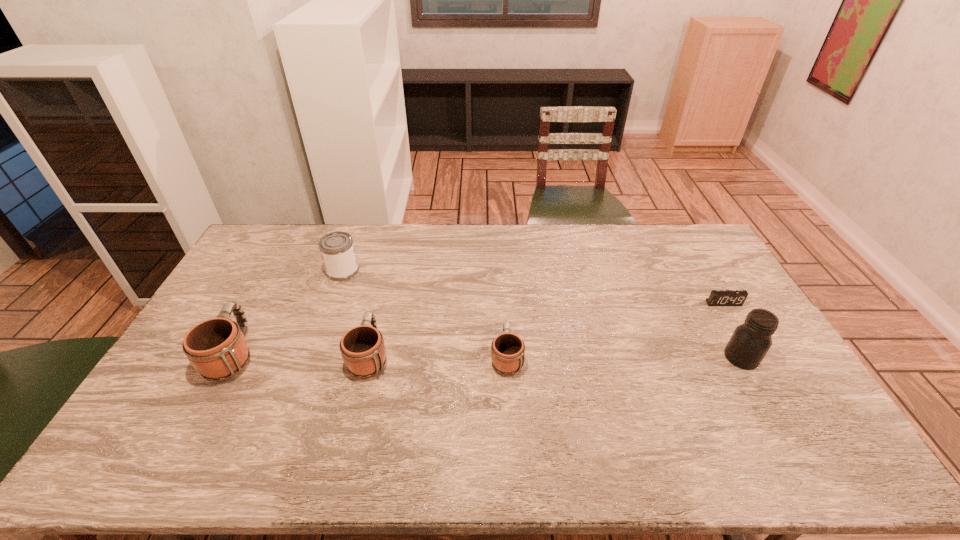
Where is `vacant region located 0.230m on the back of the farthest object`? vacant region located 0.230m on the back of the farthest object is located at coordinates (359, 226).

Locate an element on the screen. This screenshot has width=960, height=540. vacant area situated 0.120m on the front-facing side of the alarm clock is located at coordinates (741, 334).

You are a GUI agent. You are given a task and a screenshot of the screen. Output one action in this format:
    pyautogui.click(x=<x>, y=<y>)
    Task: Click on the blank space located on the left of the jar
    This screenshot has height=540, width=960.
    Given the screenshot: What is the action you would take?
    pyautogui.click(x=623, y=357)

At what (x,y) coordinates should I click in order to perform the action: click on object that is at the far edge. Please return your answer as a coordinate pair (x, y). Looking at the image, I should click on (337, 250).

Locate an element on the screen. Image resolution: width=960 pixels, height=540 pixels. object positioned at the left edge is located at coordinates (216, 348).

This screenshot has width=960, height=540. What are the coordinates of `alarm clock at the right edge` in the screenshot? It's located at (717, 297).

Locate an element on the screen. jar present at the right edge is located at coordinates (750, 342).

I want to click on vacant region at the far edge of the desktop, so click(x=447, y=232).

In order to click on vacant area at the near edge in this screenshot , I will do `click(331, 402)`.

Locate an element on the screen. free region at the left edge of the desktop is located at coordinates (228, 288).